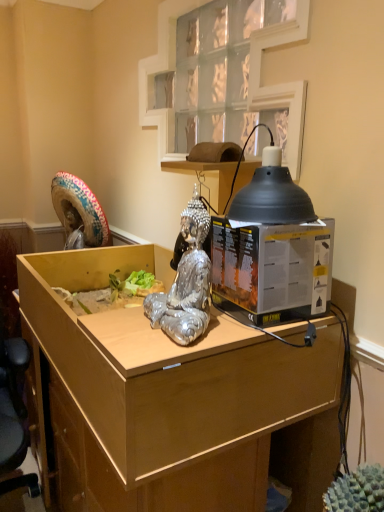
The width and height of the screenshot is (384, 512). Describe the element at coordinates (186, 283) in the screenshot. I see `shiny silver statue at center` at that location.

In order to face black matte lampshade at upper right, should I rotate leftwards or rightwards?

It's best to rotate right around 10.240 degrees.

Locate an element on the screen. This screenshot has height=512, width=384. matte black desktop computer at center is located at coordinates tap(272, 269).

Considering their positions, is black matte lampshade at upper right located in front of or behind matte black desktop computer at center?

In the image, black matte lampshade at upper right appears in front of matte black desktop computer at center.

In the scene shown: From the image's perspective, does black matte lampshade at upper right appear lower than matte black desktop computer at center?

Actually, black matte lampshade at upper right appears above matte black desktop computer at center in the image.

Considering the relative sizes of black matte lampshade at upper right and matte black desktop computer at center in the image provided, is black matte lampshade at upper right taller than matte black desktop computer at center?

No, black matte lampshade at upper right is not taller than matte black desktop computer at center.

Based on the photo, from a real-world perspective, is black matte lampshade at upper right beneath matte black desktop computer at center?

No, from a real-world perspective, black matte lampshade at upper right is not under matte black desktop computer at center.

Considering the sizes of matte black desktop computer at center and black matte lampshade at upper right in the image, is matte black desktop computer at center taller or shorter than black matte lampshade at upper right?

In the image, matte black desktop computer at center appears to be taller than black matte lampshade at upper right.

You are a GUI agent. You are given a task and a screenshot of the screen. Output one action in this format:
    pyautogui.click(x=<x>, y=<y>)
    Task: Click on the lamp located above the matte black desktop computer at center (from a real-world perspective)
    
    Given the screenshot: What is the action you would take?
    pyautogui.click(x=272, y=194)

Is matte black desktop computer at center facing away from black matte lampshade at upper right?

No, black matte lampshade at upper right is not at the back of matte black desktop computer at center.

Is shiny silver statue at center facing towards wooden desk at center?

No, shiny silver statue at center is not facing towards wooden desk at center.

Would you say shiny silver statue at center is outside wooden desk at center?

Yes, shiny silver statue at center is outside of wooden desk at center.

Based on their sizes in the image, would you say shiny silver statue at center is bigger or smaller than wooden desk at center?

Considering their sizes, shiny silver statue at center takes up less space than wooden desk at center.

Consider the image. From a real-world perspective, which is physically above, shiny silver statue at center or wooden desk at center?

shiny silver statue at center.

Is matte black desktop computer at center oriented towards wooden desk at center?

No, matte black desktop computer at center is not oriented towards wooden desk at center.

Is matte black desktop computer at center wider than wooden desk at center?

No, matte black desktop computer at center is not wider than wooden desk at center.

Is black matte lampshade at upper right spatially inside wooden desk at center, or outside of it?

black matte lampshade at upper right is not inside wooden desk at center, it's outside.

Considering the sizes of black matte lampshade at upper right and wooden desk at center in the image, is black matte lampshade at upper right wider or thinner than wooden desk at center?

Clearly, black matte lampshade at upper right has less width compared to wooden desk at center.

How different are the orientations of black matte lampshade at upper right and wooden desk at center in degrees?

3.63 degrees separate the facing orientations of black matte lampshade at upper right and wooden desk at center.

From the image's perspective, is black matte lampshade at upper right located above wooden desk at center?

Indeed, from the image's perspective, black matte lampshade at upper right is shown above wooden desk at center.

Is matte black desktop computer at center completely or partially inside shiny silver statue at center?

Definitely not — matte black desktop computer at center is not inside shiny silver statue at center.

Based on the photo, is shiny silver statue at center to the left or to the right of matte black desktop computer at center in the image?

shiny silver statue at center is positioned on matte black desktop computer at center's left side.

Relative to matte black desktop computer at center, is shiny silver statue at center in front or behind?

Visually, shiny silver statue at center is located in front of matte black desktop computer at center.

Considering the positions of objects matte black desktop computer at center and shiny silver statue at center in the image provided, who is more to the right, matte black desktop computer at center or shiny silver statue at center?

matte black desktop computer at center is more to the right.

From the image's perspective, which object appears higher, matte black desktop computer at center or shiny silver statue at center?

shiny silver statue at center.

Is matte black desktop computer at center behind shiny silver statue at center?

Yes.

Looking at this image, between matte black desktop computer at center and shiny silver statue at center, which one has less height?

Standing shorter between the two is matte black desktop computer at center.

The height and width of the screenshot is (512, 384). What are the coordinates of `lamp above the matte black desktop computer at center (from the image's perspective)` in the screenshot? It's located at (272, 194).

At what (x,y) coordinates should I click in order to perform the action: click on lamp above the matte black desktop computer at center (from a real-world perspective). Please return your answer as a coordinate pair (x, y). Image resolution: width=384 pixels, height=512 pixels. Looking at the image, I should click on (272, 194).

Estimate the real-world distances between objects in this image. Which object is closer to matte black desktop computer at center, wooden desk at center or shiny silver statue at center?

Among the two, shiny silver statue at center is located nearer to matte black desktop computer at center.

From the picture: Based on their spatial positions, is matte black desktop computer at center or wooden desk at center further from black matte lampshade at upper right?

wooden desk at center.

When comparing their distances from shiny silver statue at center, does wooden desk at center or matte black desktop computer at center seem further?

The object further to shiny silver statue at center is wooden desk at center.

Considering their positions, is matte black desktop computer at center positioned closer to wooden desk at center than shiny silver statue at center?

matte black desktop computer at center.

From the image, which object appears to be farther from black matte lampshade at upper right, wooden desk at center or shiny silver statue at center?

wooden desk at center.

Which object lies nearer to the anchor point matte black desktop computer at center, shiny silver statue at center or wooden desk at center?

A: shiny silver statue at center lies closer to matte black desktop computer at center than the other object.

Which object lies nearer to the anchor point wooden desk at center, shiny silver statue at center or matte black desktop computer at center?

matte black desktop computer at center.

Considering their positions, is black matte lampshade at upper right positioned further to matte black desktop computer at center than shiny silver statue at center?

Among the two, shiny silver statue at center is located further to matte black desktop computer at center.

Where is `desktop computer between shiny silver statue at center and black matte lampshade at upper right`? This screenshot has width=384, height=512. desktop computer between shiny silver statue at center and black matte lampshade at upper right is located at coordinates (272, 269).

Locate an element on the screen. This screenshot has height=512, width=384. person between black matte lampshade at upper right and wooden desk at center in the vertical direction is located at coordinates (186, 283).

Locate an element on the screen. The height and width of the screenshot is (512, 384). person between wooden desk at center and matte black desktop computer at center in the horizontal direction is located at coordinates (186, 283).

The image size is (384, 512). What are the coordinates of `desktop computer situated between wooden desk at center and black matte lampshade at upper right from left to right` in the screenshot? It's located at (272, 269).